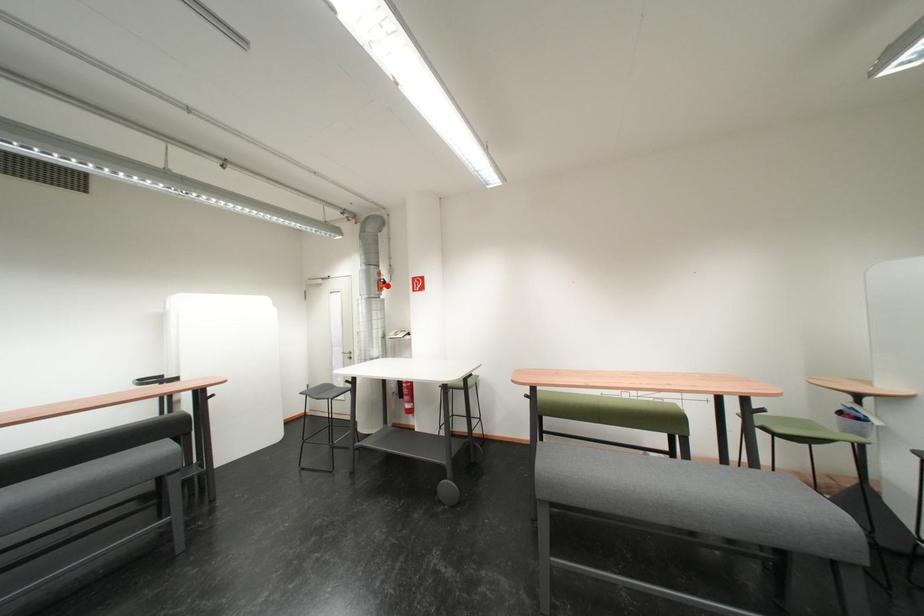
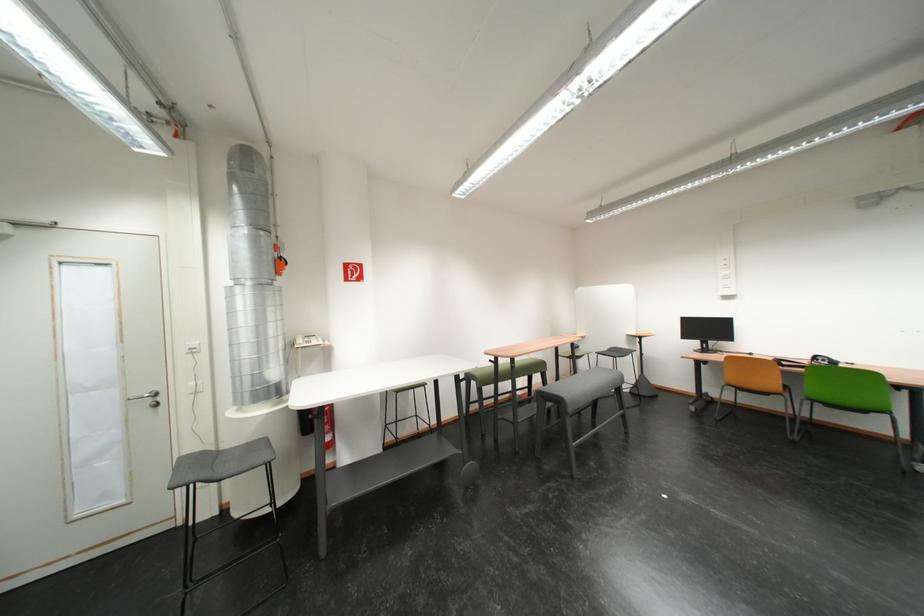
In the second image, find the point that corresponds to the highlighted location in the first image.

(284, 265)